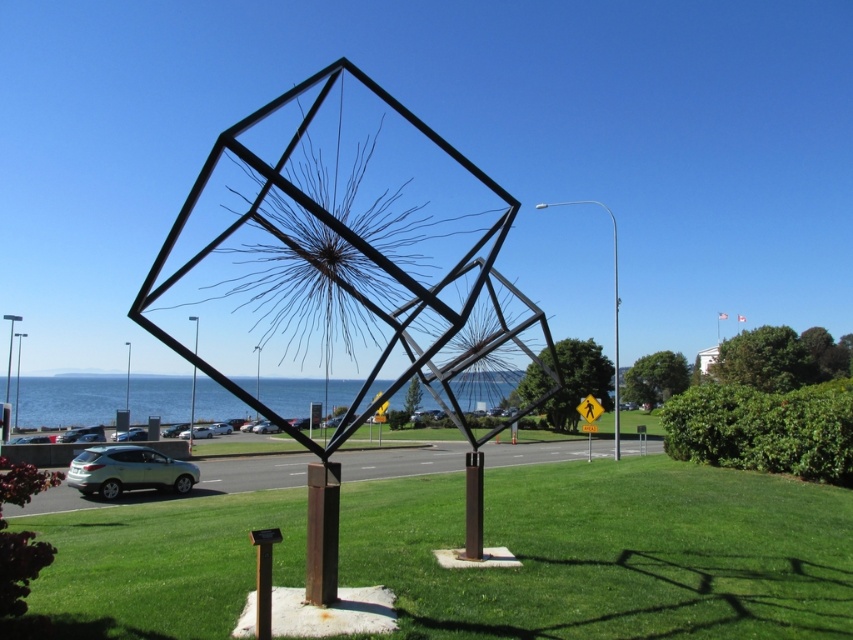
Question: Which object appears farthest from the camera in this image?

Choices:
 (A) green grass at center
 (B) satin silver suv at lower left
 (C) metallic pole at center
 (D) black metal pole at center

Answer: (C)

Question: Does satin silver suv at lower left lie behind black metal pole at center?

Choices:
 (A) no
 (B) yes

Answer: (A)

Question: From the image, what is the correct spatial relationship of satin silver suv at lower left in relation to metallic pole at center?

Choices:
 (A) right
 (B) left

Answer: (A)

Question: Which point is farther to the camera?

Choices:
 (A) green grass at center
 (B) satin silver suv at lower left
 (C) black metal pole at center
 (D) blue water at center

Answer: (C)

Question: Which point is closer to the camera?

Choices:
 (A) blue water at center
 (B) satin silver suv at lower left
 (C) green grass at center
 (D) black metal pole at center

Answer: (C)

Question: Is the position of satin silver suv at lower left less distant than that of black metal pole at center?

Choices:
 (A) no
 (B) yes

Answer: (B)